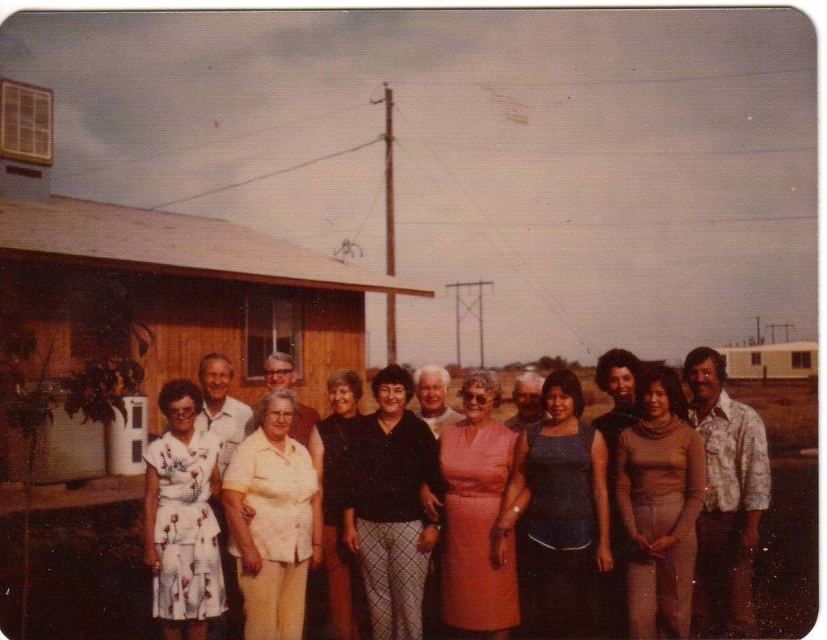
Can you confirm if white cotton blouse at center is positioned below black matte dress at center?

No.

Looking at this image, does white cotton blouse at center have a lesser width compared to black matte dress at center?

No.

Is point (299, 442) positioned behind point (328, 477)?

No, (299, 442) is in front of (328, 477).

Identify the location of white cotton blouse at center. (271, 522).

Is beige jersey dress at center to the left of white cotton blouse at center from the viewer's perspective?

In fact, beige jersey dress at center is to the right of white cotton blouse at center.

Is point (668, 460) in front of point (319, 512)?

That is True.

Locate an element on the screen. The height and width of the screenshot is (640, 827). beige jersey dress at center is located at coordinates pyautogui.click(x=658, y=506).

Is floral cotton dress at center thinner than black matte dress at center?

No, floral cotton dress at center is not thinner than black matte dress at center.

How much distance is there between floral cotton dress at center and black matte dress at center?

They are 5.98 feet apart.

You are a GUI agent. You are given a task and a screenshot of the screen. Output one action in this format:
    pyautogui.click(x=<x>, y=<y>)
    Task: Click on the floral cotton dress at center
    The width and height of the screenshot is (827, 640).
    Given the screenshot: What is the action you would take?
    pyautogui.click(x=682, y=492)